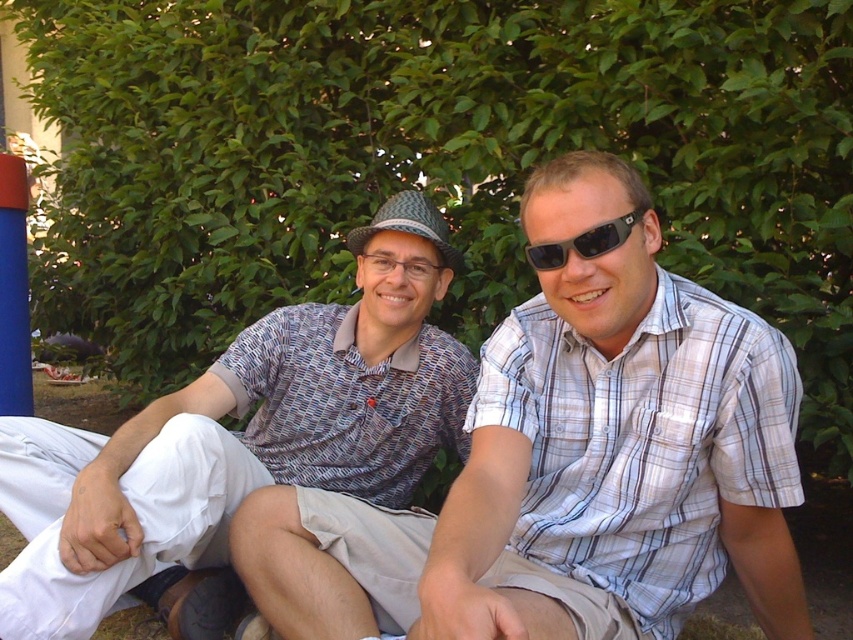
You are a GUI agent. You are given a task and a screenshot of the screen. Output one action in this format:
    pyautogui.click(x=<x>, y=<y>)
    Task: Click on the white cotton shirt at center
    
    Given the screenshot: What is the action you would take?
    pyautogui.click(x=570, y=465)

Is point (527, 337) in front of point (550, 243)?

No, (527, 337) is behind (550, 243).

Does point (546, 355) come closer to viewer compared to point (577, 248)?

No, it is not.

Identify the location of white cotton shirt at center. (570, 465).

Who is more distant from viewer, (335, 308) or (540, 244)?

Positioned behind is point (335, 308).

Which of these two, patterned fabric shirt at center or black plastic sunglasses at center, stands taller?

With more height is patterned fabric shirt at center.

Find the location of a particular element. patterned fabric shirt at center is located at coordinates (242, 435).

Locate an element on the screen. This screenshot has height=640, width=853. patterned fabric shirt at center is located at coordinates (242, 435).

Which of these two, white cotton shirt at center or patterned fabric shirt at center, stands taller?

With more height is patterned fabric shirt at center.

Image resolution: width=853 pixels, height=640 pixels. What do you see at coordinates (570, 465) in the screenshot?
I see `white cotton shirt at center` at bounding box center [570, 465].

Locate an element on the screen. Image resolution: width=853 pixels, height=640 pixels. white cotton shirt at center is located at coordinates (570, 465).